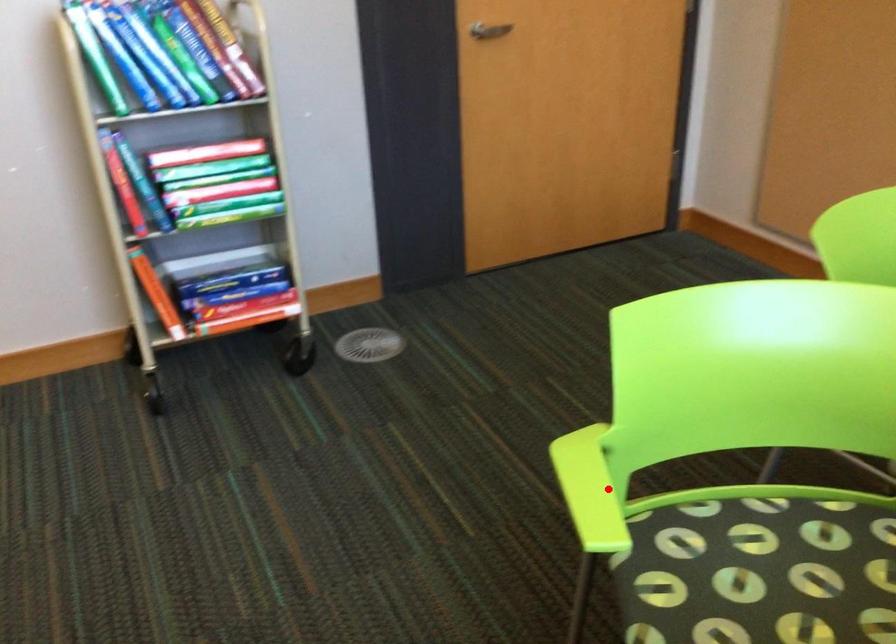
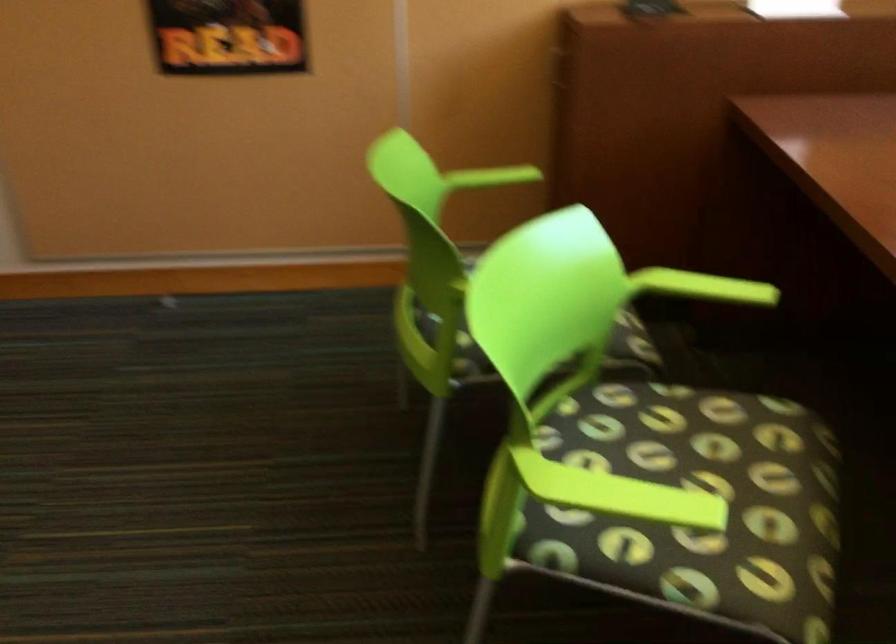
Locate, in the second image, the point that corresponds to the highlighted location in the first image.

(619, 494)